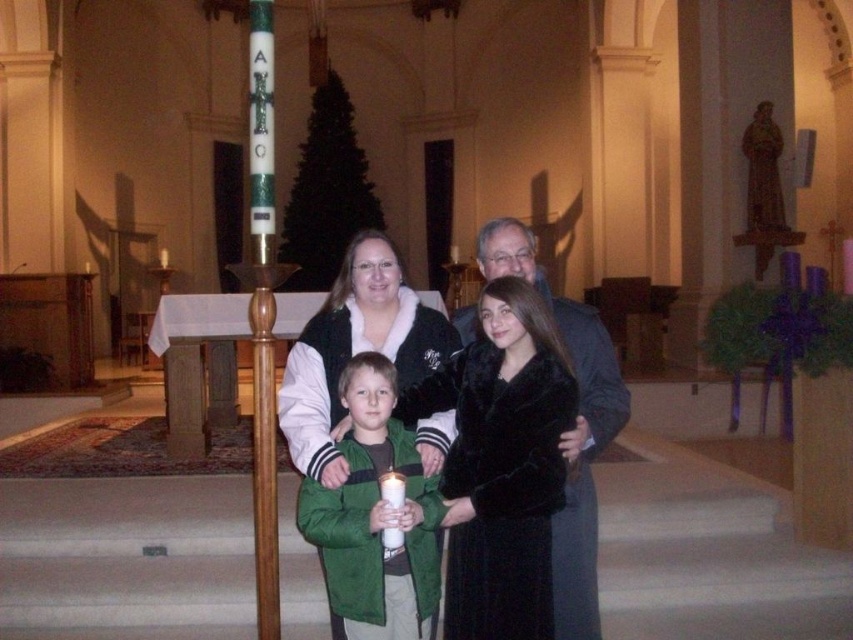
Between green fuzzy jacket at center and velvet gray coat at center, which one has less height?

Standing shorter between the two is velvet gray coat at center.

Is point (405, 618) positioned in front of point (605, 397)?

Yes, it is in front of point (605, 397).

The height and width of the screenshot is (640, 853). Describe the element at coordinates (376, 516) in the screenshot. I see `green fuzzy jacket at center` at that location.

Locate an element on the screen. Image resolution: width=853 pixels, height=640 pixels. green fuzzy jacket at center is located at coordinates (376, 516).

Can you confirm if black fur coat at center is positioned to the left of velvet gray coat at center?

Indeed, black fur coat at center is positioned on the left side of velvet gray coat at center.

Find the location of a particular element. black fur coat at center is located at coordinates (503, 490).

Does black fur coat at center lie in front of green fuzzy jacket at center?

No, it is behind green fuzzy jacket at center.

Between point (474, 570) and point (432, 554), which one is positioned in front?

Point (474, 570)

Identify the location of black fur coat at center. (503, 490).